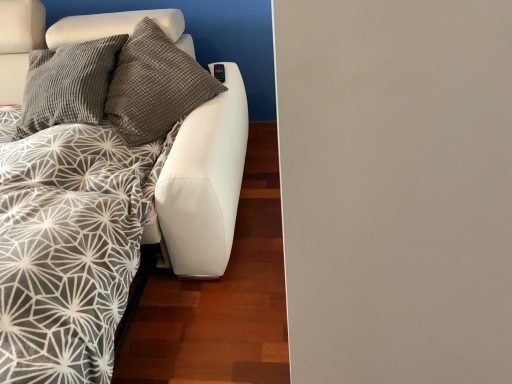
Question: Can you confirm if white leather couch at left is taller than textured gray pillows at upper left?

Choices:
 (A) yes
 (B) no

Answer: (A)

Question: Does white leather couch at left have a smaller size compared to textured gray pillows at upper left?

Choices:
 (A) no
 (B) yes

Answer: (A)

Question: Is white leather couch at left wider than textured gray pillows at upper left?

Choices:
 (A) yes
 (B) no

Answer: (A)

Question: Is white leather couch at left surrounding textured gray pillows at upper left?

Choices:
 (A) yes
 (B) no

Answer: (A)

Question: Considering the relative sizes of white leather couch at left and textured gray pillows at upper left in the image provided, is white leather couch at left bigger than textured gray pillows at upper left?

Choices:
 (A) no
 (B) yes

Answer: (B)

Question: From a real-world perspective, is white leather couch at left below textured gray pillows at upper left?

Choices:
 (A) no
 (B) yes

Answer: (B)

Question: Considering the relative sizes of textured gray pillows at upper left and white leather couch at left in the image provided, is textured gray pillows at upper left wider than white leather couch at left?

Choices:
 (A) yes
 (B) no

Answer: (B)

Question: Is the surface of textured gray pillows at upper left in direct contact with white leather couch at left?

Choices:
 (A) yes
 (B) no

Answer: (B)

Question: Is textured gray pillows at upper left further to camera compared to white leather couch at left?

Choices:
 (A) no
 (B) yes

Answer: (B)

Question: From the image's perspective, is textured gray pillows at upper left on white leather couch at left?

Choices:
 (A) yes
 (B) no

Answer: (A)

Question: Can you confirm if textured gray pillows at upper left is shorter than white leather couch at left?

Choices:
 (A) yes
 (B) no

Answer: (A)

Question: Would you say textured gray pillows at upper left is outside white leather couch at left?

Choices:
 (A) yes
 (B) no

Answer: (B)

Question: From a real-world perspective, is white leather couch at left physically located above or below textured gray pillows at upper left?

Choices:
 (A) below
 (B) above

Answer: (A)